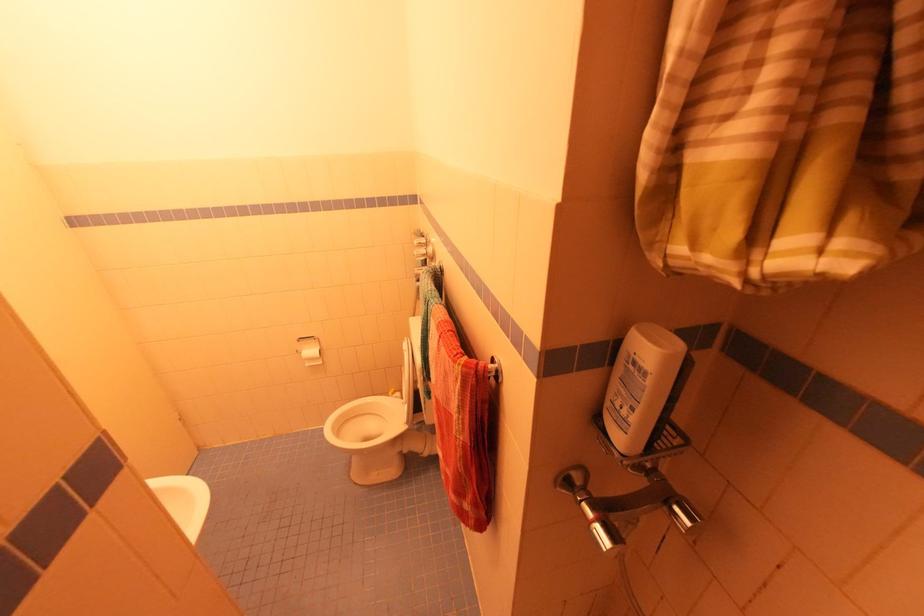
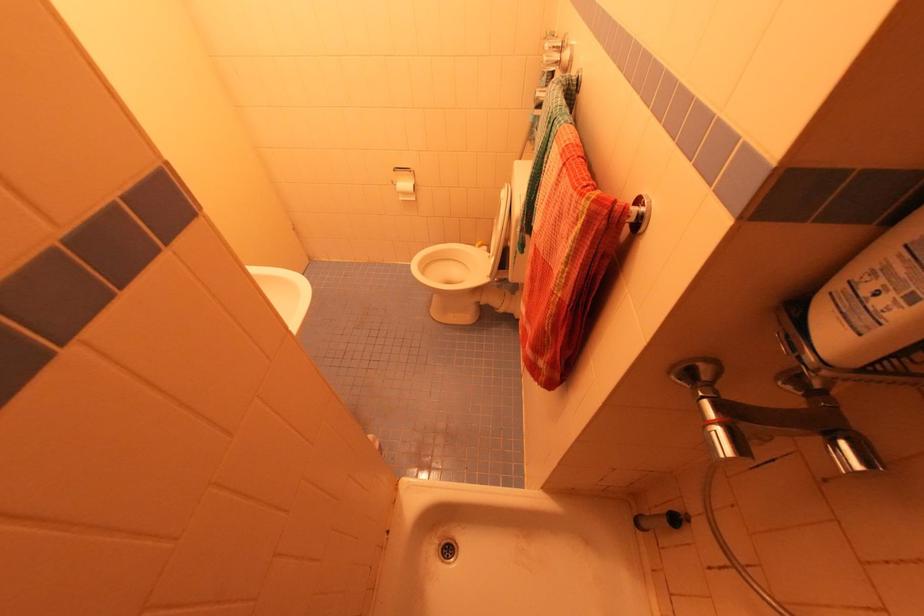
Locate, in the second image, the point that corresponds to point 689,524 in the first image.

(859, 467)